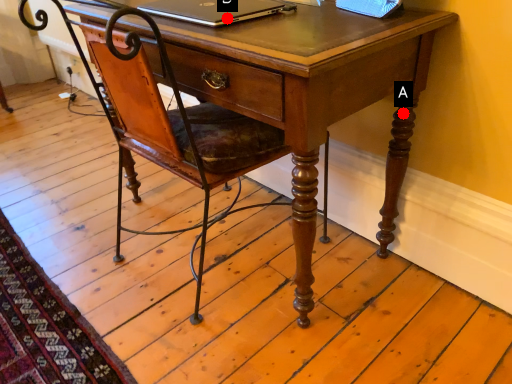
Question: Two points are circled on the image, labeled by A and B beside each circle. Which point is farther from the camera taking this photo?

Choices:
 (A) A is further
 (B) B is further

Answer: (A)